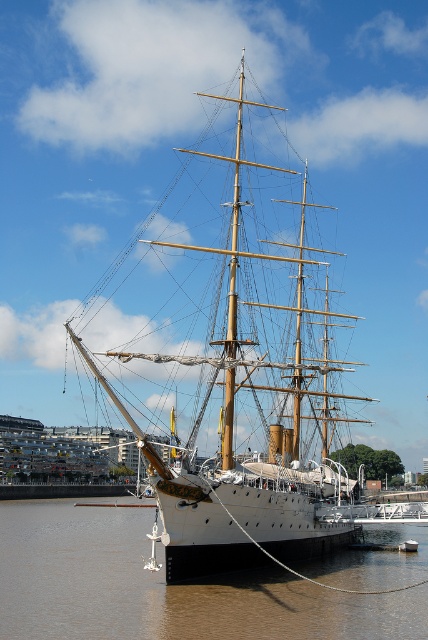
Which is more to the right, white polished wood sailboat at center or brown/muddy water at lower center?

From the viewer's perspective, white polished wood sailboat at center appears more on the right side.

Does point (217, 472) come closer to viewer compared to point (115, 518)?

Yes, it is in front of point (115, 518).

You are a GUI agent. You are given a task and a screenshot of the screen. Output one action in this format:
    pyautogui.click(x=<x>, y=<y>)
    Task: Click on the white polished wood sailboat at center
    The image size is (428, 640).
    Given the screenshot: What is the action you would take?
    pyautogui.click(x=250, y=388)